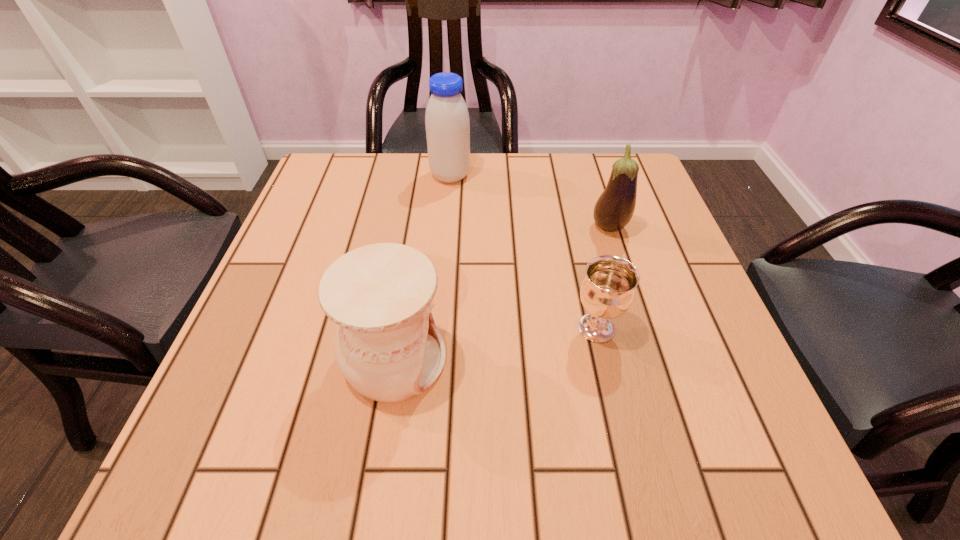
The height and width of the screenshot is (540, 960). I want to click on object situated at the right edge, so click(x=615, y=207).

In order to click on free space at the far edge of the desktop in this screenshot , I will do `click(506, 164)`.

Where is `vacant space at the near edge of the desktop`? This screenshot has height=540, width=960. vacant space at the near edge of the desktop is located at coordinates click(x=528, y=426).

Where is `vacant space at the left edge`? vacant space at the left edge is located at coordinates [245, 377].

I want to click on vacant space at the right edge of the desktop, so click(653, 338).

Locate an element on the screen. The width and height of the screenshot is (960, 540). free region at the far left corner of the desktop is located at coordinates (324, 175).

Image resolution: width=960 pixels, height=540 pixels. In the image, there is a desktop. Find the location of `vacant space at the near left corner`. vacant space at the near left corner is located at coordinates (194, 434).

You are a GUI agent. You are given a task and a screenshot of the screen. Output one action in this format:
    pyautogui.click(x=<x>, y=<y>)
    Task: Click on the vacant space at the far right corner of the desktop
    
    Given the screenshot: What is the action you would take?
    pyautogui.click(x=655, y=191)

Image resolution: width=960 pixels, height=540 pixels. What are the coordinates of `free space at the near right corner` in the screenshot? It's located at (763, 476).

Where is `vacant area that lies between the chalice and the tallest object`? Image resolution: width=960 pixels, height=540 pixels. vacant area that lies between the chalice and the tallest object is located at coordinates (523, 252).